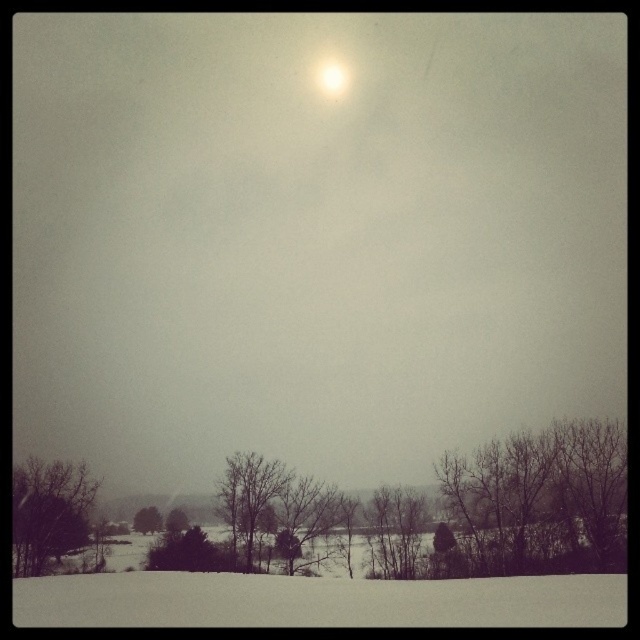
Question: Is white powdery snow at lower center bigger than bare branches at center?

Choices:
 (A) no
 (B) yes

Answer: (B)

Question: Where is bare branches at lower right located in relation to bare branches at lower center in the image?

Choices:
 (A) below
 (B) above

Answer: (B)

Question: Does bare branches at center have a larger size compared to bare branches at lower center?

Choices:
 (A) yes
 (B) no

Answer: (A)

Question: Among these points, which one is nearest to the camera?

Choices:
 (A) (262, 484)
 (B) (541, 500)

Answer: (B)

Question: Which of the following is the farthest from the observer?

Choices:
 (A) (449, 504)
 (B) (241, 532)

Answer: (A)

Question: Which point appears farthest from the camera in this image?

Choices:
 (A) (253, 497)
 (B) (472, 512)
 (C) (88, 480)
 (D) (145, 513)

Answer: (D)